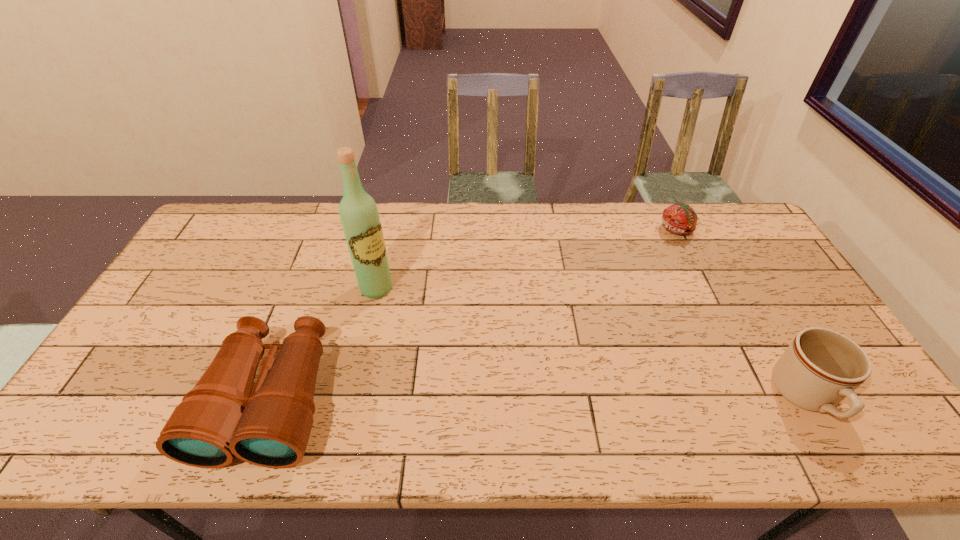
You are a GUI agent. You are given a task and a screenshot of the screen. Output one action in this format:
    pyautogui.click(x=<x>, y=<y>)
    Task: Click on the binoculars
    
    Given the screenshot: What is the action you would take?
    tap(219, 418)

At what (x,y) coordinates should I click in order to perform the action: click on mug. Please return your answer as a coordinate pair (x, y). The width and height of the screenshot is (960, 540). Looking at the image, I should click on (821, 367).

This screenshot has height=540, width=960. I want to click on wine bottle, so click(359, 215).

At what (x,y) coordinates should I click in order to perform the action: click on the tallest object. Please return your answer as a coordinate pair (x, y). This screenshot has height=540, width=960. Looking at the image, I should click on (359, 215).

Locate an element on the screen. the farthest object is located at coordinates (680, 219).

Locate an element on the screen. Image resolution: width=960 pixels, height=540 pixels. the shortest object is located at coordinates (680, 219).

At what (x,y) coordinates should I click in order to perform the action: click on vacant space located on the front-facing side of the tallest object. Please return your answer as a coordinate pair (x, y). This screenshot has width=960, height=540. Looking at the image, I should click on (415, 323).

The width and height of the screenshot is (960, 540). In order to click on vacant position located on the front-facing side of the tallest object in this screenshot , I will do `click(415, 323)`.

Where is `vacant area located on the front-facing side of the tallest object`? This screenshot has width=960, height=540. vacant area located on the front-facing side of the tallest object is located at coordinates (476, 380).

The image size is (960, 540). What are the coordinates of `free location located on the front-facing side of the farthest object` in the screenshot? It's located at (632, 315).